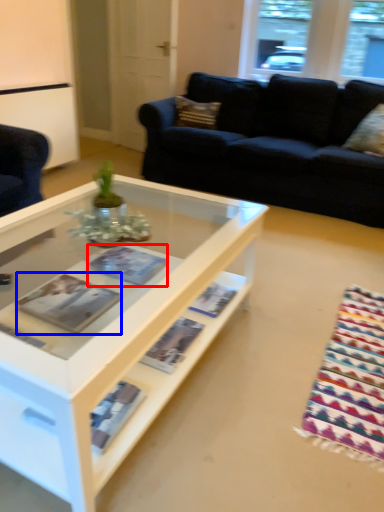
Question: Which of the following is the closest to the observer, magazine (highlighted by a red box) or magazine (highlighted by a blue box)?

Choices:
 (A) magazine
 (B) magazine

Answer: (B)